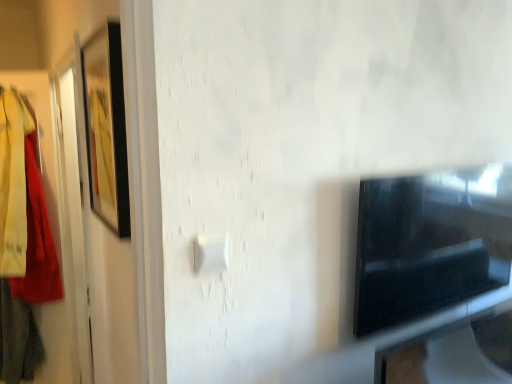
Question: Is matte black picture frame at left touching black glossy tv at right?

Choices:
 (A) yes
 (B) no

Answer: (B)

Question: Does matte black picture frame at left have a greater height compared to black glossy tv at right?

Choices:
 (A) no
 (B) yes

Answer: (B)

Question: Is matte black picture frame at left at the left side of black glossy tv at right?

Choices:
 (A) no
 (B) yes

Answer: (B)

Question: From the image's perspective, is matte black picture frame at left under black glossy tv at right?

Choices:
 (A) yes
 (B) no

Answer: (B)

Question: Is matte black picture frame at left to the right of black glossy tv at right from the viewer's perspective?

Choices:
 (A) no
 (B) yes

Answer: (A)

Question: Is matte black picture frame at left turned away from black glossy tv at right?

Choices:
 (A) yes
 (B) no

Answer: (A)

Question: Is black glossy tv at right turned away from matte black picture frame at left?

Choices:
 (A) no
 (B) yes

Answer: (A)

Question: Is black glossy tv at right smaller than matte black picture frame at left?

Choices:
 (A) no
 (B) yes

Answer: (A)

Question: Can we say black glossy tv at right lies outside matte black picture frame at left?

Choices:
 (A) yes
 (B) no

Answer: (A)

Question: From a real-world perspective, is black glossy tv at right below matte black picture frame at left?

Choices:
 (A) no
 (B) yes

Answer: (B)

Question: Is black glossy tv at right closer to the viewer compared to matte black picture frame at left?

Choices:
 (A) no
 (B) yes

Answer: (A)

Question: Are black glossy tv at right and matte black picture frame at left far apart?

Choices:
 (A) yes
 (B) no

Answer: (B)

Question: Is the position of black glossy tv at right less distant than that of white plastic light switch at center?

Choices:
 (A) no
 (B) yes

Answer: (A)